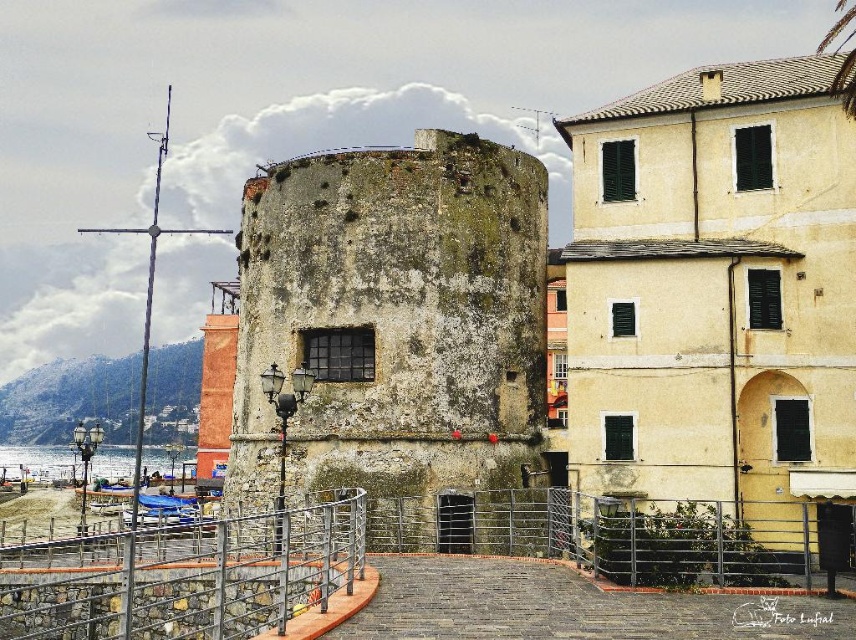
You are a tourist standing in front of the coastal scene. You want to take a photo that includes both the yellowish concrete building at center and the weathered stone tower at center. Which one should you position closer to the front of the frame to ensure both are fully visible in the photo?

To ensure both the yellowish concrete building at center and the weathered stone tower at center are fully visible in the photo, position the yellowish concrete building at center closer to the front of the frame since it is shorter than the weathered stone tower at center.

You are standing at the base of the cylindrical stone tower and want to reach both point A at point (690,442) and point B at point (420,260). Which point will you reach first if you move forward in a straight line?

You will reach point A at point (690,442) first because it is closer to the viewer than point B at point (420,260).

Looking at this image, you are a tourist standing at the base of the weathered stone tower at center and want to take a photo of the metallic gray railing at lower center without the tower blocking the view. Is this possible?

The metallic gray railing at lower center is behind the weathered stone tower at center, so taking a photo of the metallic gray railing at lower center without the tower blocking the view is not possible.